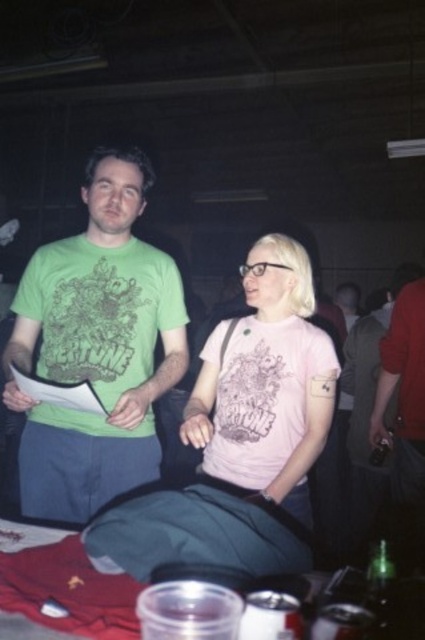
Question: Which object appears closest to the camera in this image?

Choices:
 (A) pink matte shirt at center
 (B) green printed t-shirt at center
 (C) green matte t-shirt at center

Answer: (A)

Question: Which is nearer to the red matte shirt at right?

Choices:
 (A) green printed t-shirt at center
 (B) green matte t-shirt at center

Answer: (B)

Question: Does green printed t-shirt at center appear over red matte shirt at right?

Choices:
 (A) yes
 (B) no

Answer: (A)

Question: Is the position of green printed t-shirt at center more distant than that of pink matte shirt at center?

Choices:
 (A) no
 (B) yes

Answer: (B)

Question: Is green matte t-shirt at center in front of pink matte shirt at center?

Choices:
 (A) yes
 (B) no

Answer: (B)

Question: Which of the following is the farthest from the observer?

Choices:
 (A) green printed t-shirt at center
 (B) pink matte shirt at center
 (C) green matte t-shirt at center

Answer: (C)